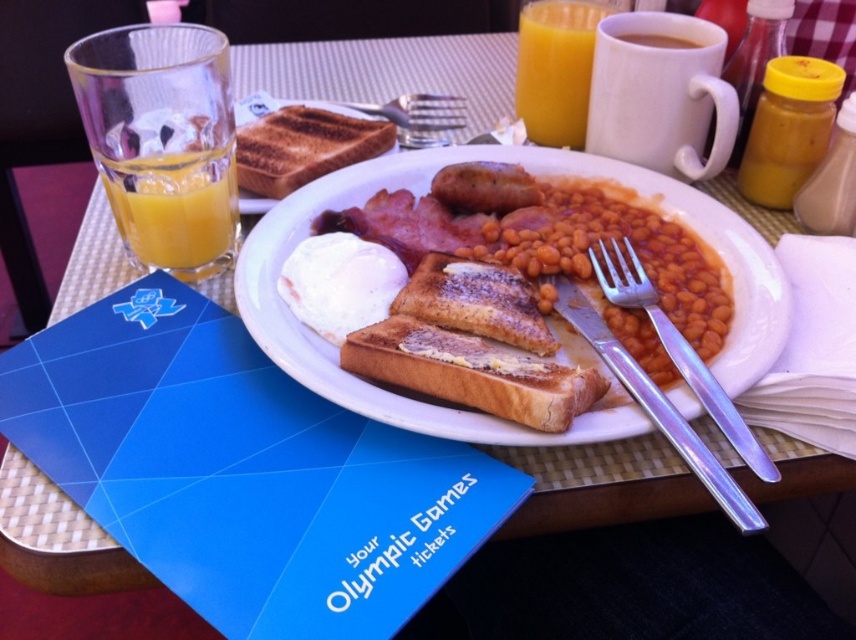
Describe the element at coordinates (548, 317) in the screenshot. This screenshot has width=856, height=640. I see `white glazed plate at center` at that location.

Is white glazed plate at center above translucent glass at left?

Incorrect, white glazed plate at center is not positioned above translucent glass at left.

Identify the location of white glazed plate at center. (548, 317).

Which is more to the right, translucent glass mug at upper center or brown matte sausage at center?

From the viewer's perspective, translucent glass mug at upper center appears more on the right side.

Can you confirm if translucent glass mug at upper center is shorter than brown matte sausage at center?

In fact, translucent glass mug at upper center may be taller than brown matte sausage at center.

What do you see at coordinates (556, 68) in the screenshot? I see `translucent glass mug at upper center` at bounding box center [556, 68].

Image resolution: width=856 pixels, height=640 pixels. In order to click on translucent glass mug at upper center in this screenshot , I will do `click(556, 68)`.

Does translucent glass mug at upper center have a larger size compared to translucent glass at upper left?

Yes, translucent glass mug at upper center is bigger than translucent glass at upper left.

Who is higher up, translucent glass mug at upper center or translucent glass at upper left?

translucent glass mug at upper center

Is point (522, 77) positioned after point (780, 113)?

Yes.

Locate an element on the screen. This screenshot has width=856, height=640. translucent glass mug at upper center is located at coordinates (556, 68).